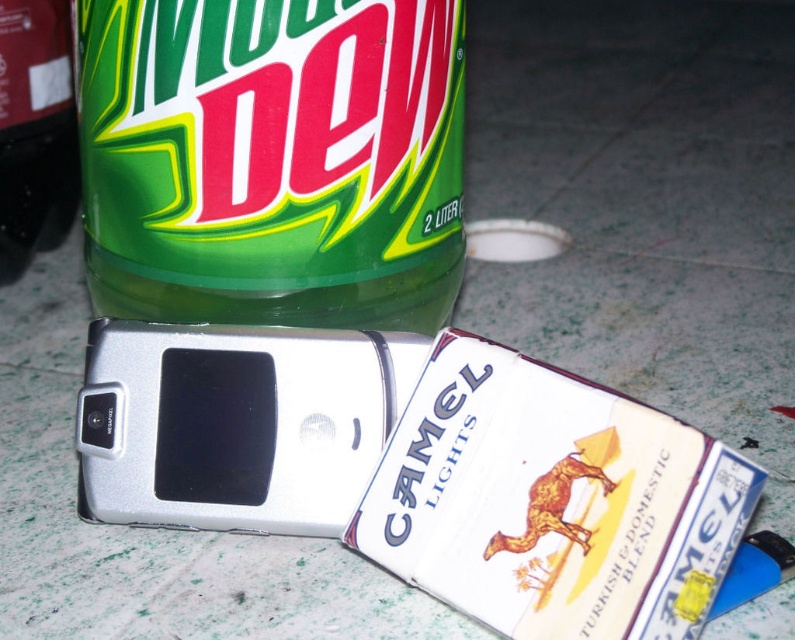
Question: Which object is the closest to the green matte bottle at upper left?

Choices:
 (A) green matte plastic bottle at upper left
 (B) silver metallic phone at center

Answer: (A)

Question: Which object appears farthest from the camera in this image?

Choices:
 (A) green matte plastic bottle at upper left
 (B) green matte bottle at upper left
 (C) silver metallic phone at center

Answer: (B)

Question: Is green matte plastic bottle at upper left positioned in front of silver metallic phone at center?

Choices:
 (A) yes
 (B) no

Answer: (B)

Question: From the image, what is the correct spatial relationship of green matte plastic bottle at upper left in relation to silver metallic phone at center?

Choices:
 (A) below
 (B) above

Answer: (B)

Question: Among these points, which one is farthest from the camera?

Choices:
 (A) (152, 147)
 (B) (130, 330)
 (C) (72, 93)

Answer: (C)

Question: Is silver metallic phone at center wider than green matte bottle at upper left?

Choices:
 (A) no
 (B) yes

Answer: (B)